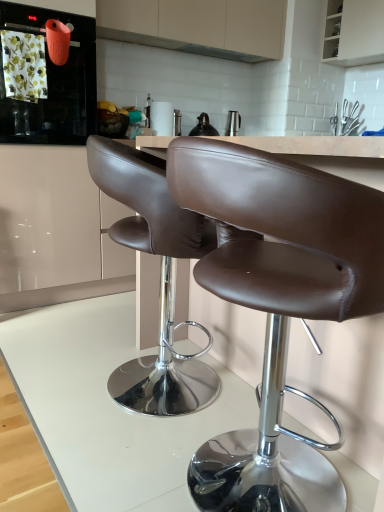
Question: Is brown leather chair at center, the 1th chair from the front, aimed at matte orange kettle at upper left?

Choices:
 (A) yes
 (B) no

Answer: (B)

Question: Is matte orange kettle at upper left a part of brown leather chair at center, the 1th chair from the front?

Choices:
 (A) yes
 (B) no

Answer: (B)

Question: Does brown leather chair at center, which is counted as the 2th chair, starting from the back, have a smaller size compared to matte orange kettle at upper left?

Choices:
 (A) no
 (B) yes

Answer: (A)

Question: From a real-world perspective, is brown leather chair at center, which is counted as the 2th chair, starting from the back, below matte orange kettle at upper left?

Choices:
 (A) no
 (B) yes

Answer: (B)

Question: Does brown leather chair at center, which is counted as the 2th chair, starting from the back, appear on the right side of matte orange kettle at upper left?

Choices:
 (A) yes
 (B) no

Answer: (A)

Question: Choose the correct answer: Is white glossy cabinet at upper right, marked as the 2th cabinetry in a left-to-right arrangement, inside brown leather chair at center, the 1th chair from the front, or outside it?

Choices:
 (A) inside
 (B) outside

Answer: (B)

Question: In the image, is white glossy cabinet at upper right, marked as the 2th cabinetry in a left-to-right arrangement, positioned in front of or behind brown leather chair at center, the 1th chair from the front?

Choices:
 (A) behind
 (B) front

Answer: (A)

Question: Based on their sizes in the image, would you say white glossy cabinet at upper right, placed as the first cabinetry when sorted from right to left, is bigger or smaller than brown leather chair at center, which is counted as the 2th chair, starting from the back?

Choices:
 (A) big
 (B) small

Answer: (B)

Question: From a real-world perspective, is white glossy cabinet at upper right, placed as the first cabinetry when sorted from right to left, above or below brown leather chair at center, which is counted as the 2th chair, starting from the back?

Choices:
 (A) above
 (B) below

Answer: (A)

Question: Is white glossy table at center bigger or smaller than brown leather chair at center, the 1th chair positioned from the back?

Choices:
 (A) small
 (B) big

Answer: (A)

Question: From the image's perspective, is white glossy table at center above or below brown leather chair at center, the 1th chair positioned from the back?

Choices:
 (A) below
 (B) above

Answer: (A)

Question: From a real-world perspective, is white glossy table at center physically located above or below brown leather chair at center, the 1th chair positioned from the back?

Choices:
 (A) above
 (B) below

Answer: (B)

Question: Looking at their shapes, would you say white glossy table at center is wider or thinner than brown leather chair at center, the 2th chair positioned from the front?

Choices:
 (A) wide
 (B) thin

Answer: (A)

Question: From the image's perspective, relative to metallic silver exhaust hood at upper center, is black matte tea pot at upper center above or below?

Choices:
 (A) below
 (B) above

Answer: (A)

Question: Looking at the image, does black matte tea pot at upper center seem bigger or smaller compared to metallic silver exhaust hood at upper center?

Choices:
 (A) small
 (B) big

Answer: (B)